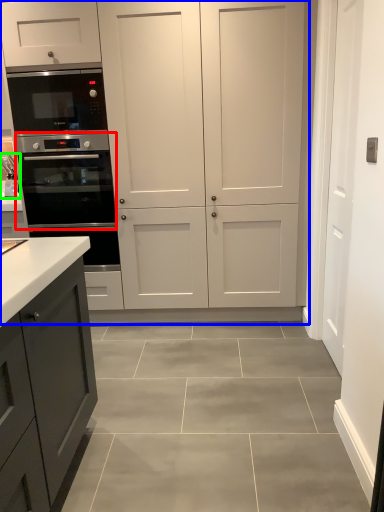
Question: Estimate the real-world distances between objects in this image. Which object is farther from oven (highlighted by a red box), cupboard (highlighted by a blue box) or sink (highlighted by a green box)?

Choices:
 (A) cupboard
 (B) sink

Answer: (B)